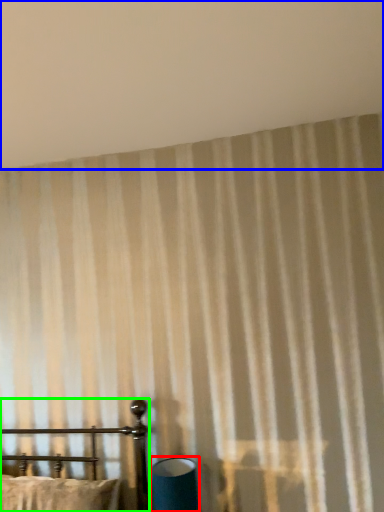
Question: Which object is the closest to the table lamp (highlighted by a red box)? Choose among these: backdrop (highlighted by a blue box) or furniture (highlighted by a green box).

Choices:
 (A) backdrop
 (B) furniture

Answer: (B)